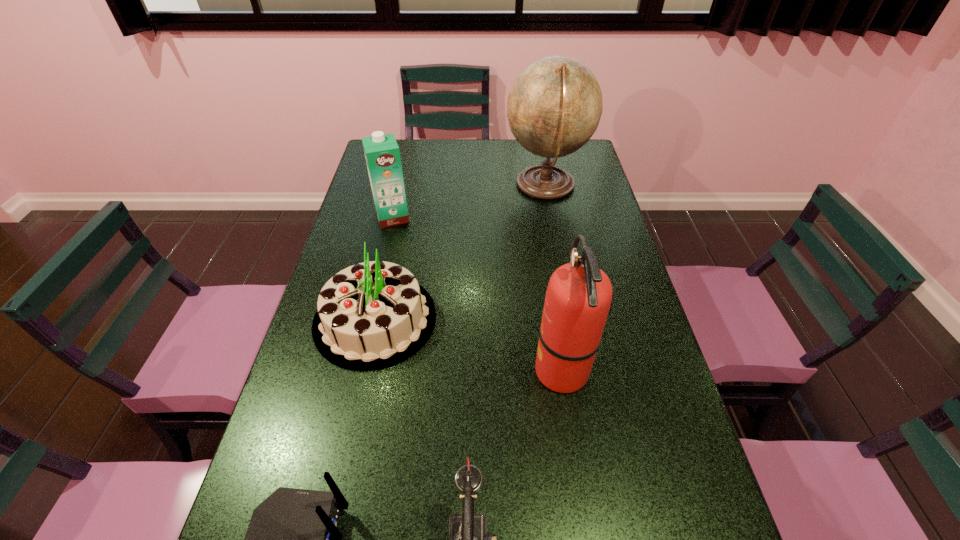
Find the location of a particular element. The image size is (960, 540). vacant space situated 0.320m on the front of the carton is located at coordinates (373, 301).

Where is `vacant region located 0.150m on the back of the birthday cake`? The height and width of the screenshot is (540, 960). vacant region located 0.150m on the back of the birthday cake is located at coordinates (392, 243).

I want to click on object that is at the far edge, so click(x=554, y=107).

The width and height of the screenshot is (960, 540). Identify the location of carton that is at the left edge. (382, 154).

Where is `birthday cake that is at the left edge`? birthday cake that is at the left edge is located at coordinates (370, 316).

Where is `object at the right edge`? object at the right edge is located at coordinates (554, 107).

This screenshot has width=960, height=540. Find the location of `object situated at the far right corner`. object situated at the far right corner is located at coordinates (554, 107).

In order to click on free space at the far edge of the desktop in this screenshot , I will do `click(434, 163)`.

Find the location of a particular element. The width and height of the screenshot is (960, 540). vacant space at the left edge is located at coordinates pyautogui.click(x=366, y=222).

Find the location of a particular element. The image size is (960, 540). vacant space at the right edge is located at coordinates (582, 182).